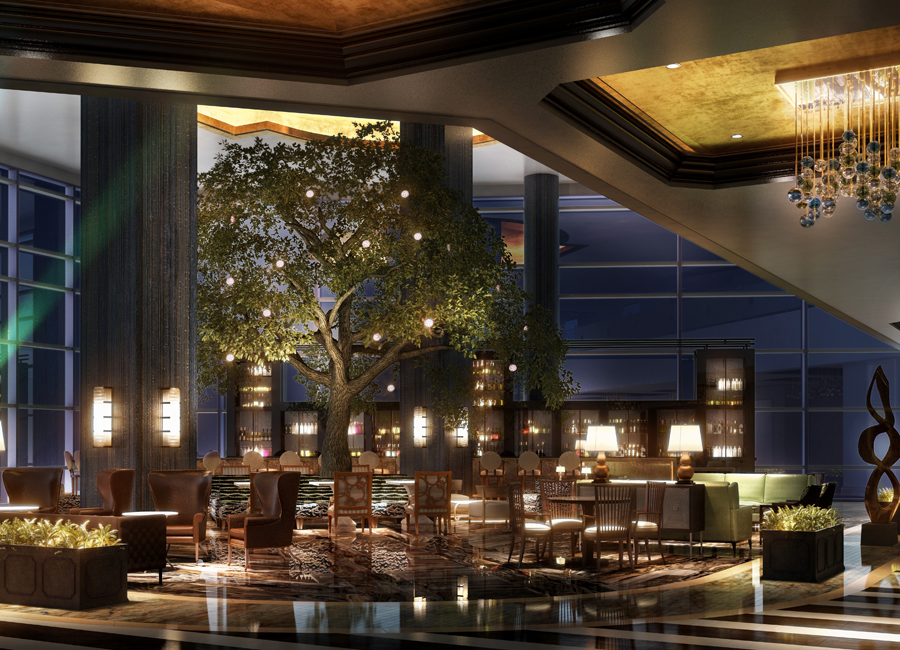
This screenshot has height=650, width=900. I want to click on planters, so click(812, 560), click(40, 580).